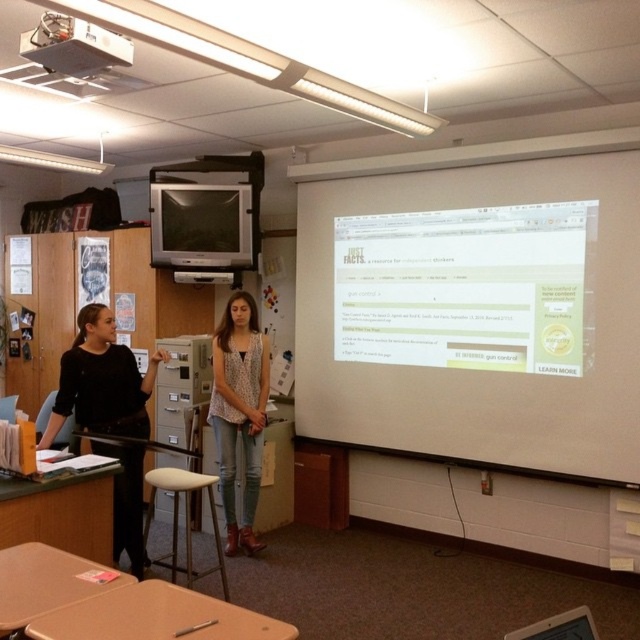
Question: From the image, what is the correct spatial relationship of white matte projection screen at center in relation to white matte stool at center?

Choices:
 (A) below
 (B) above

Answer: (B)

Question: Which point is farther to the camera?

Choices:
 (A) white matte stool at center
 (B) black fabric shirt at left

Answer: (A)

Question: Does black fabric shirt at left have a smaller size compared to white matte stool at center?

Choices:
 (A) yes
 (B) no

Answer: (A)

Question: Where is white matte projection screen at center located in relation to black fabric shirt at left in the image?

Choices:
 (A) below
 (B) above

Answer: (B)

Question: Which point is closer to the camera taking this photo?

Choices:
 (A) (99, 58)
 (B) (177, 524)
 (C) (220, 358)

Answer: (A)

Question: Which object is positioned farthest from the white matte stool at center?

Choices:
 (A) black fabric shirt at left
 (B) white plastic projector at upper left

Answer: (B)